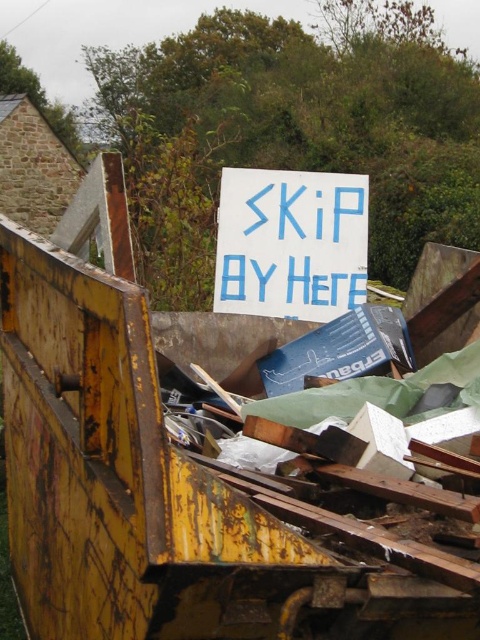
Is point (242, 492) less distant than point (264, 307)?

Yes.

Does point (107, 579) lie behind point (323, 284)?

No, it is not.

Who is more forward, (x=84, y=372) or (x=241, y=186)?

Point (x=84, y=372) is in front.

I want to click on rusty metal garbage truck at center, so click(212, 486).